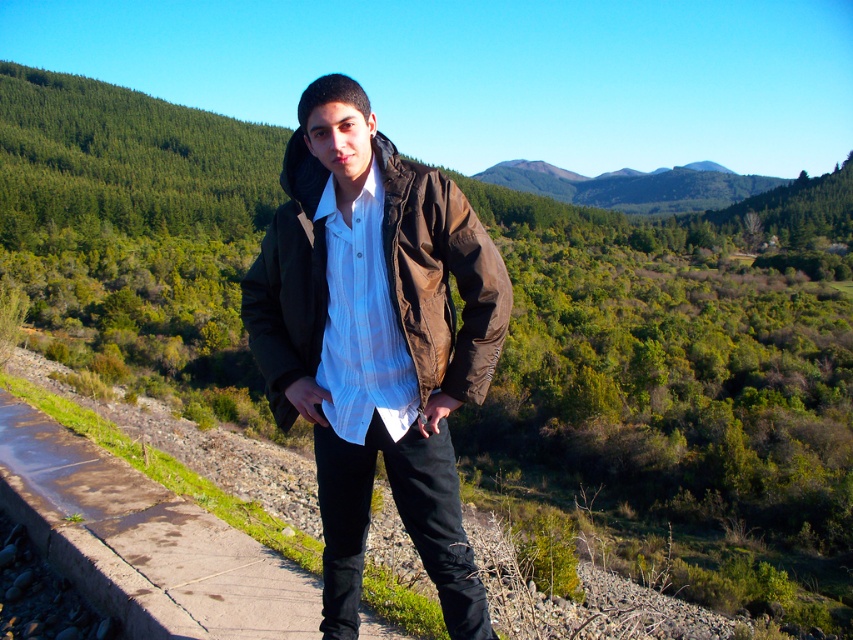
Is concrete sidewalk at center below brown matte jacket at center?

Yes.

Does concrete sidewalk at center come behind brown matte jacket at center?

Yes, concrete sidewalk at center is further from the viewer.

The width and height of the screenshot is (853, 640). Describe the element at coordinates (144, 541) in the screenshot. I see `concrete sidewalk at center` at that location.

Where is `concrete sidewalk at center`? concrete sidewalk at center is located at coordinates (144, 541).